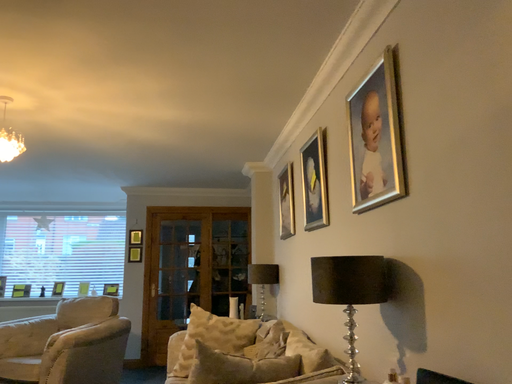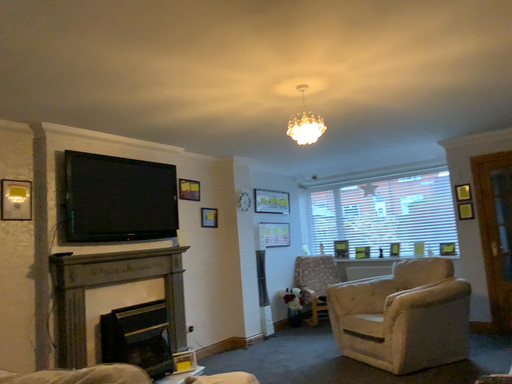
Question: Which way did the camera rotate in the video?

Choices:
 (A) rotated upward
 (B) rotated downward

Answer: (B)